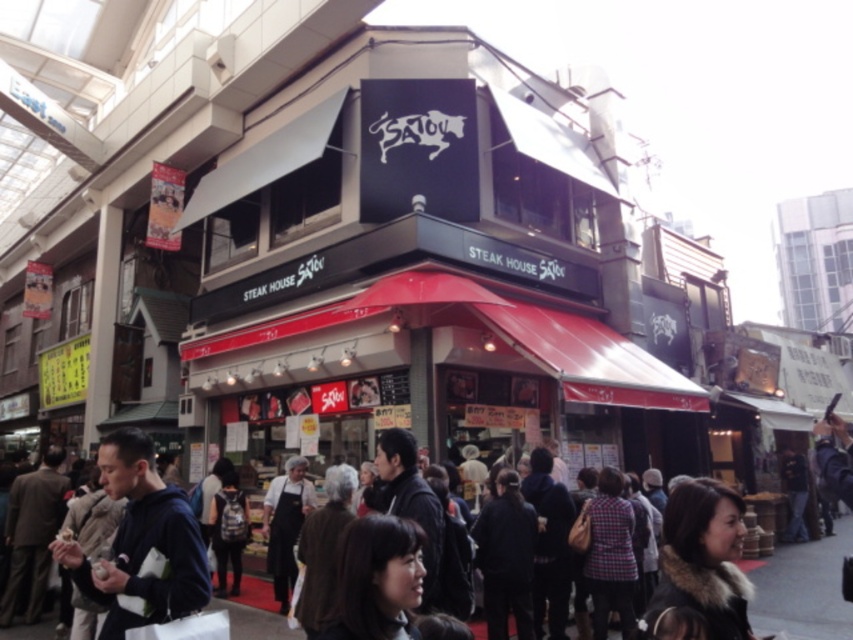
Question: Is dark blue hoodie at lower left to the left of dark brown fur-trimmed coat at center from the viewer's perspective?

Choices:
 (A) yes
 (B) no

Answer: (A)

Question: Does dark brown fur-trimmed coat at center have a greater width compared to dark brown leather jacket at center?

Choices:
 (A) no
 (B) yes

Answer: (A)

Question: Estimate the real-world distances between objects in this image. Which object is closer to the dark blue hoodie at lower left?

Choices:
 (A) dark brown leather jacket at center
 (B) dark brown fur-trimmed coat at center

Answer: (B)

Question: Which object appears closest to the camera in this image?

Choices:
 (A) dark brown leather jacket at center
 (B) dark brown fur-trimmed coat at center
 (C) dark blue hoodie at lower left

Answer: (B)

Question: Does dark blue hoodie at lower left lie in front of dark brown fur-trimmed coat at center?

Choices:
 (A) yes
 (B) no

Answer: (B)

Question: Estimate the real-world distances between objects in this image. Which object is closer to the dark brown fur-trimmed coat at center?

Choices:
 (A) dark blue hoodie at lower left
 (B) dark brown leather jacket at center

Answer: (A)